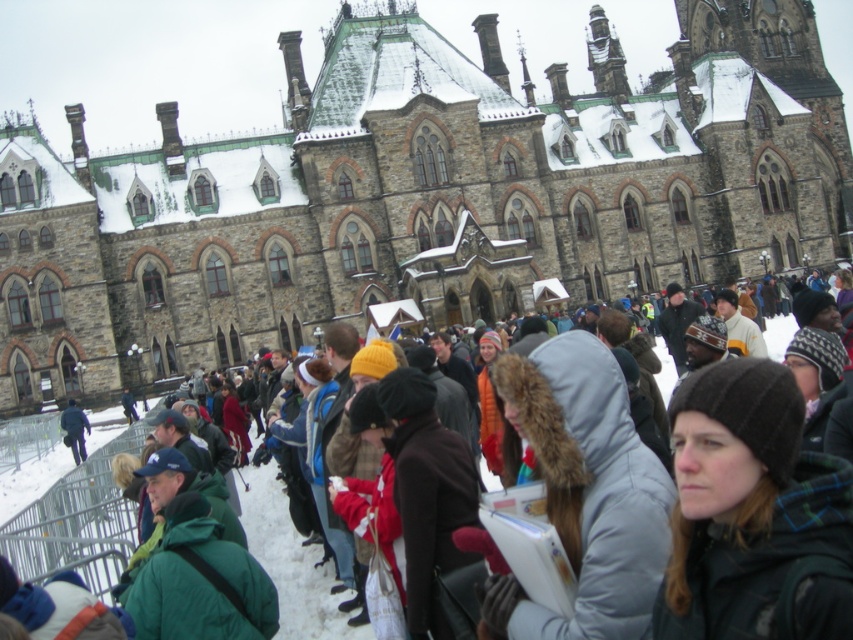
This screenshot has width=853, height=640. What do you see at coordinates (419, 195) in the screenshot?
I see `stone church at center` at bounding box center [419, 195].

Identify the location of stone church at center. The width and height of the screenshot is (853, 640). click(x=419, y=195).